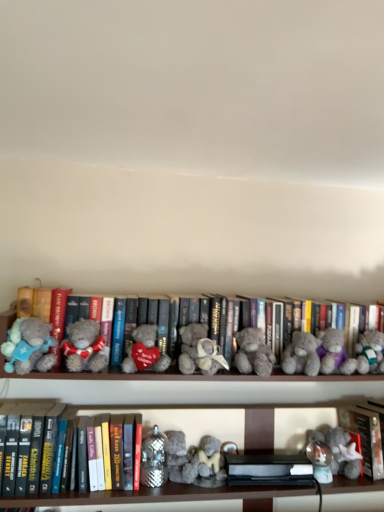
Question: Is fuzzy gray teddy bear at lower right, acting as the 1th toy starting from the left, next to fluffy gray teddy bear at left, placed as the 6th teddy bear when sorted from right to left?

Choices:
 (A) yes
 (B) no

Answer: (B)

Question: Could you tell me if fuzzy gray teddy bear at lower right, acting as the second toy starting from the top, is facing fluffy gray teddy bear at left, the second teddy bear viewed from the left?

Choices:
 (A) yes
 (B) no

Answer: (B)

Question: Is fuzzy gray teddy bear at lower right, which appears as the 1th toy when ordered from the bottom, turned away from fluffy gray teddy bear at left, the second teddy bear viewed from the left?

Choices:
 (A) yes
 (B) no

Answer: (B)

Question: Is fuzzy gray teddy bear at lower right, which appears as the 1th toy when ordered from the bottom, in front of fluffy gray teddy bear at left, placed as the 6th teddy bear when sorted from right to left?

Choices:
 (A) no
 (B) yes

Answer: (A)

Question: Is fuzzy gray teddy bear at lower right, acting as the 1th toy starting from the left, to the left of fluffy gray teddy bear at left, the second teddy bear viewed from the left, from the viewer's perspective?

Choices:
 (A) no
 (B) yes

Answer: (A)

Question: In terms of height, does fuzzy gray teddy bear at center, placed as the 3th teddy bear when sorted from right to left, look taller or shorter compared to fluffy gray teddy bear at center, the sixth teddy bear when ordered from left to right?

Choices:
 (A) tall
 (B) short

Answer: (A)

Question: From a real-world perspective, is fuzzy gray teddy bear at center, placed as the 3th teddy bear when sorted from right to left, positioned above or below fluffy gray teddy bear at center, the second teddy bear when ordered from right to left?

Choices:
 (A) above
 (B) below

Answer: (A)

Question: Is fuzzy gray teddy bear at center, the fifth teddy bear from the left, wider or thinner than fluffy gray teddy bear at center, the second teddy bear when ordered from right to left?

Choices:
 (A) thin
 (B) wide

Answer: (B)

Question: Do you think fuzzy gray teddy bear at center, the fifth teddy bear from the left, is within fluffy gray teddy bear at center, the sixth teddy bear when ordered from left to right, or outside of it?

Choices:
 (A) inside
 (B) outside

Answer: (B)

Question: From their relative heights in the image, would you say gray plush toy at right, marked as the first toy in a right-to-left arrangement, is taller or shorter than fluffy gray teddy bear at left, the second teddy bear viewed from the left?

Choices:
 (A) tall
 (B) short

Answer: (A)

Question: Considering the positions of point tap(380, 337) and point tap(104, 356), is point tap(380, 337) closer or farther from the camera than point tap(104, 356)?

Choices:
 (A) closer
 (B) farther

Answer: (B)

Question: From a real-world perspective, is gray plush toy at right, arranged as the 2th toy when viewed from the left, positioned above or below fluffy gray teddy bear at left, placed as the 6th teddy bear when sorted from right to left?

Choices:
 (A) above
 (B) below

Answer: (B)

Question: Is gray plush toy at right, positioned as the first toy in top-to-bottom order, in front of or behind fluffy gray teddy bear at left, the second teddy bear viewed from the left, in the image?

Choices:
 (A) front
 (B) behind

Answer: (B)

Question: From the image's perspective, is red matte book at lower right, positioned as the 1th book in right-to-left order, above or below gray plush toy at right, marked as the first toy in a right-to-left arrangement?

Choices:
 (A) below
 (B) above

Answer: (A)

Question: Choose the correct answer: Is red matte book at lower right, the 3th book from the left, inside gray plush toy at right, arranged as the 2th toy when viewed from the left, or outside it?

Choices:
 (A) inside
 (B) outside

Answer: (B)